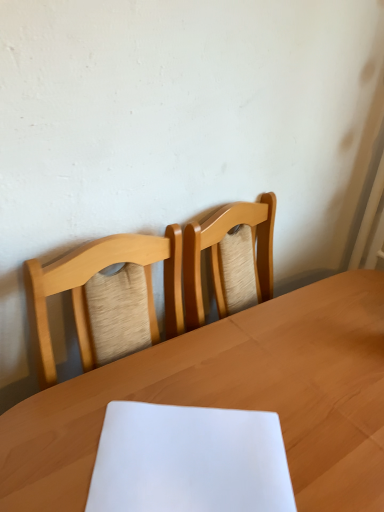
Question: Does light wood table at center appear on the left side of white paper at center?

Choices:
 (A) yes
 (B) no

Answer: (B)

Question: Can you see light wood table at center touching white paper at center?

Choices:
 (A) no
 (B) yes

Answer: (A)

Question: Is white paper at center at the back of light wood table at center?

Choices:
 (A) yes
 (B) no

Answer: (B)

Question: Does light wood table at center have a lesser width compared to white paper at center?

Choices:
 (A) no
 (B) yes

Answer: (A)

Question: From the image's perspective, is light wood table at center on white paper at center?

Choices:
 (A) yes
 (B) no

Answer: (B)

Question: Is light wood table at center behind white paper at center?

Choices:
 (A) no
 (B) yes

Answer: (A)

Question: Is light wood table at center inside white paper at center?

Choices:
 (A) no
 (B) yes

Answer: (A)

Question: Does white paper at center have a larger size compared to light wood table at center?

Choices:
 (A) yes
 (B) no

Answer: (B)

Question: Does white paper at center lie behind light wood table at center?

Choices:
 (A) no
 (B) yes

Answer: (B)

Question: From the image's perspective, is white paper at center located above light wood table at center?

Choices:
 (A) yes
 (B) no

Answer: (A)

Question: Does white paper at center have a greater height compared to light wood table at center?

Choices:
 (A) yes
 (B) no

Answer: (B)

Question: Does white paper at center have a lesser height compared to light wood table at center?

Choices:
 (A) yes
 (B) no

Answer: (A)

Question: Considering the positions of point (304, 368) and point (187, 429), is point (304, 368) closer or farther from the camera than point (187, 429)?

Choices:
 (A) closer
 (B) farther

Answer: (B)